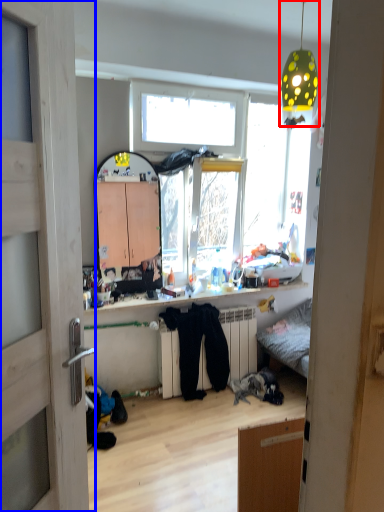
Question: Which object is closer to the camera taking this photo, light fixture (highlighted by a red box) or door (highlighted by a blue box)?

Choices:
 (A) light fixture
 (B) door

Answer: (B)